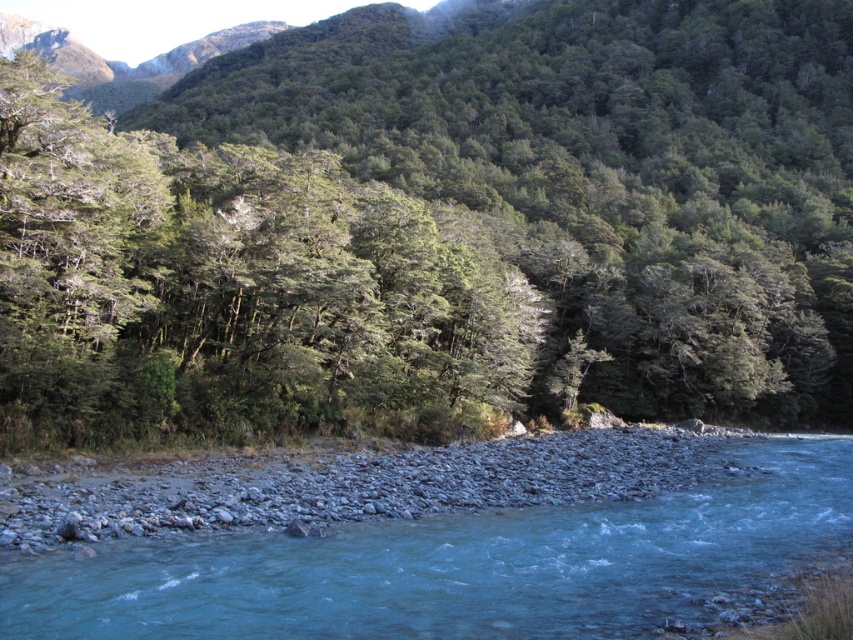
You are planning to build a small cabin in this landscape. You want to ensure it has a view of both the green leafy trees at center and the clear blue water at center. Based on their heights, which object will appear higher in your view from the cabin?

The green leafy trees at center are much taller than the clear blue water at center, so they will appear higher in your view from the cabin.

You are a hiker standing at the edge of the forest and the river. You notice the green leafy trees at center and the clear blue water at center. Which object takes up more space in the image?

The green leafy trees at center takes up more space in the image than the clear blue water at center because it is bigger than the clear blue water at center according to the description.

You are planning to build a small wooden bridge across the clear blue water at center. The bridge needs to be 10 meters wide to accommodate two lanes. Can the green leafy trees at center provide enough space for the bridge?

The green leafy trees at center might be wider than clear blue water at center, so there is a possibility that the trees are wider than the required 10 meters. However, without exact measurements, it is uncertain if the bridge can fit. Further assessment is needed.